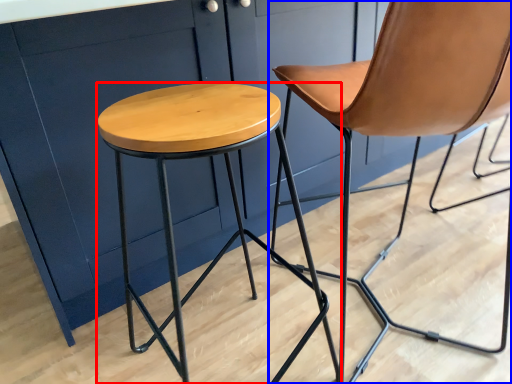
Question: Which of the following is the closest to the observer, stool (highlighted by a red box) or chair (highlighted by a blue box)?

Choices:
 (A) stool
 (B) chair

Answer: (A)